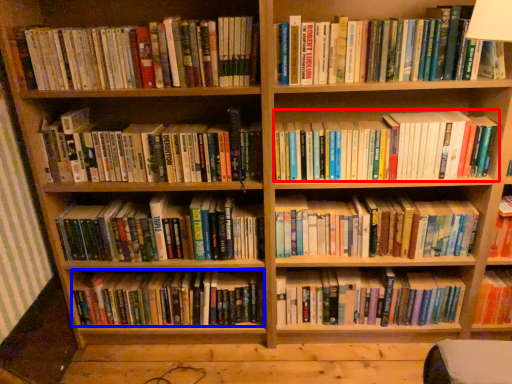
Question: Which of the following is the closest to the observer, book (highlighted by a red box) or book (highlighted by a blue box)?

Choices:
 (A) book
 (B) book

Answer: (A)